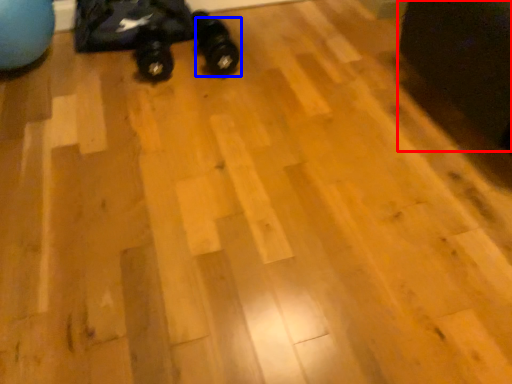
Question: Among these objects, which one is nearest to the camera, swivel chair (highlighted by a red box) or footwear (highlighted by a blue box)?

Choices:
 (A) swivel chair
 (B) footwear

Answer: (A)